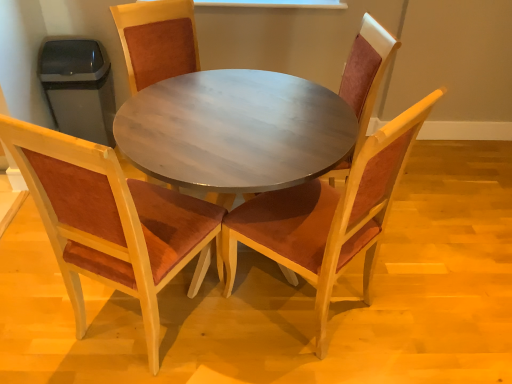
In order to click on vacant space situated on the left part of velvet brown chair at left, arranged as the first chair when viewed from the left in this screenshot , I will do `click(36, 308)`.